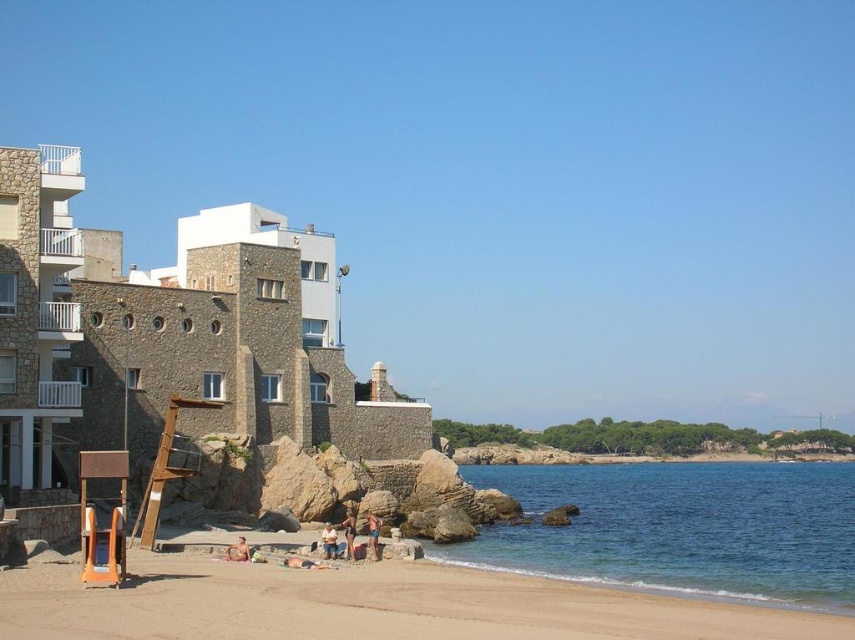
Which is behind, point (99, 445) or point (375, 545)?

Point (99, 445)

Describe the element at coordinates (171, 339) in the screenshot. I see `stone textured building at left` at that location.

Which is behind, point (84, 371) or point (370, 536)?

The point (84, 371) is more distant.

What are the coordinates of `stone textured building at left` in the screenshot? It's located at pyautogui.click(x=171, y=339).

How much distance is there between matte skin person at center and smooth tan skin at lower center?

The distance of matte skin person at center from smooth tan skin at lower center is 4.08 meters.

Does matte skin person at center have a larger size compared to smooth tan skin at lower center?

Yes.

Find the location of `matte skin person at center`. matte skin person at center is located at coordinates (349, 534).

Who is taller, clear blue water at lower right or matte skin person at center?

Standing taller between the two is clear blue water at lower right.

Who is more forward, (550, 531) or (349, 524)?

Point (349, 524) is more forward.

The height and width of the screenshot is (640, 855). I want to click on clear blue water at lower right, so click(677, 528).